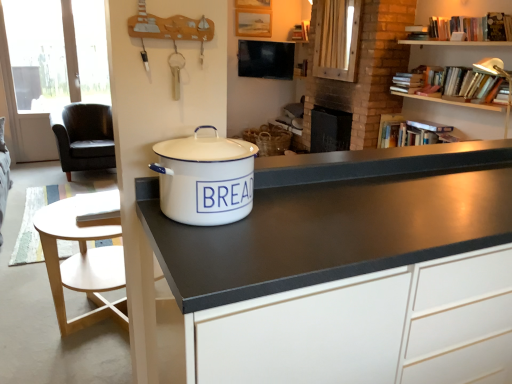
Question: Can you confirm if hardcover books at upper right is smaller than white matte cabinet at center?

Choices:
 (A) yes
 (B) no

Answer: (A)

Question: Is hardcover books at upper right not within white matte cabinet at center?

Choices:
 (A) no
 (B) yes

Answer: (B)

Question: From a real-world perspective, is hardcover books at upper right physically above white matte cabinet at center?

Choices:
 (A) yes
 (B) no

Answer: (A)

Question: Considering the relative positions of hardcover books at upper right and white matte cabinet at center in the image provided, is hardcover books at upper right to the left of white matte cabinet at center from the viewer's perspective?

Choices:
 (A) no
 (B) yes

Answer: (A)

Question: Is hardcover books at upper right behind white matte cabinet at center?

Choices:
 (A) no
 (B) yes

Answer: (B)

Question: Is hardcover books at upper right positioned with its back to white matte cabinet at center?

Choices:
 (A) yes
 (B) no

Answer: (B)

Question: Can you confirm if hardcover books at upper right is taller than white enamel bread bin at center?

Choices:
 (A) no
 (B) yes

Answer: (A)

Question: Is hardcover books at upper right positioned beyond the bounds of white enamel bread bin at center?

Choices:
 (A) no
 (B) yes

Answer: (B)

Question: Considering the relative sizes of hardcover books at upper right and white enamel bread bin at center in the image provided, is hardcover books at upper right wider than white enamel bread bin at center?

Choices:
 (A) no
 (B) yes

Answer: (A)

Question: Is hardcover books at upper right shorter than white enamel bread bin at center?

Choices:
 (A) yes
 (B) no

Answer: (A)

Question: Could you tell me if hardcover books at upper right is turned towards white enamel bread bin at center?

Choices:
 (A) yes
 (B) no

Answer: (B)

Question: Is white enamel bread bin at center at the back of hardcover books at upper right?

Choices:
 (A) yes
 (B) no

Answer: (B)

Question: From a real-world perspective, is light wood round table at lower left located higher than white matte cabinet at center?

Choices:
 (A) no
 (B) yes

Answer: (A)